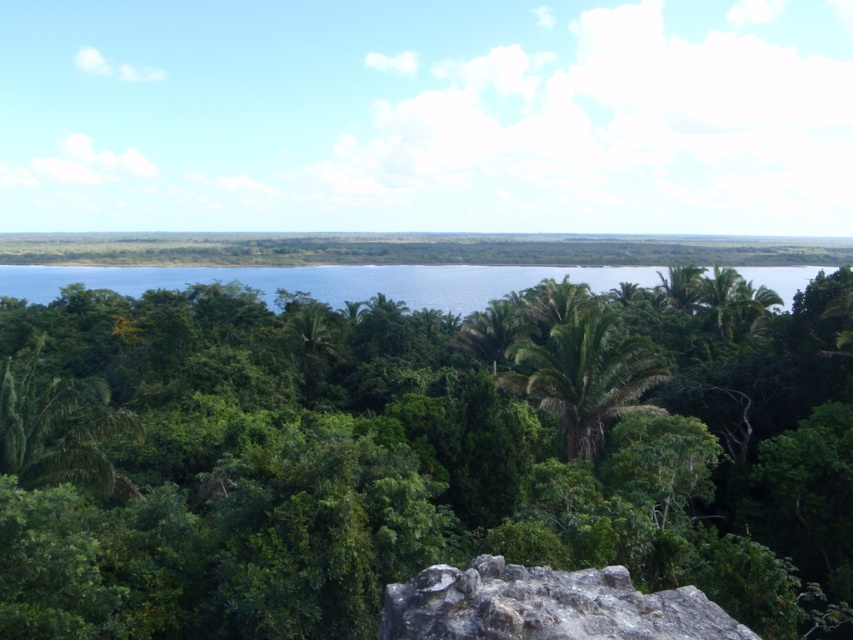
Question: Among these points, which one is farthest from the camera?

Choices:
 (A) (79, 426)
 (B) (512, 586)
 (C) (616, 269)
 (D) (595, 324)

Answer: (C)

Question: Which point is farther from the camera taking this photo?

Choices:
 (A) (512, 349)
 (B) (397, 512)

Answer: (A)

Question: Which point appears closest to the camera in this image?

Choices:
 (A) (583, 586)
 (B) (599, 438)
 (C) (335, 291)
 (D) (108, 326)

Answer: (A)

Question: Does gray rough rock at lower center appear over blue glassy water at center?

Choices:
 (A) yes
 (B) no

Answer: (B)

Question: From the image, what is the correct spatial relationship of green leafy tree at center in relation to green leafy palm tree at center?

Choices:
 (A) left
 (B) right

Answer: (A)

Question: Is green leafy tree at center thinner than gray rough rock at lower center?

Choices:
 (A) no
 (B) yes

Answer: (A)